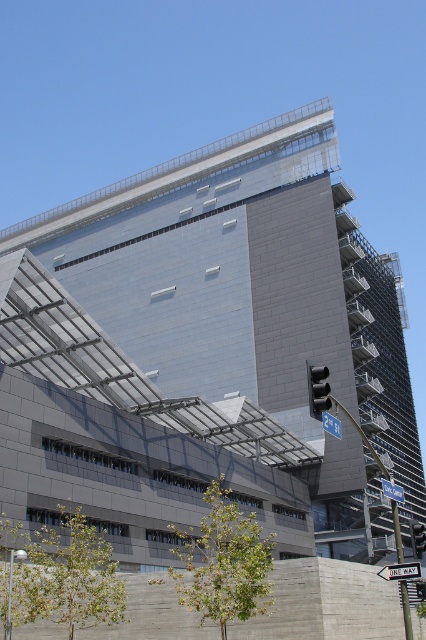
You are a city planner reviewing the architectural design. You need to determine if the white plastic street sign at lower right can be placed in a location where it won not be obscured by the blue metallic street sign at upper center. Based on their sizes, is this possible?

The white plastic street sign at lower right is smaller than the blue metallic street sign at upper center. Since the white plastic street sign is smaller, it can be placed in a position where it won not be obscured by the larger blue metallic street sign at upper center if positioned appropriately.

You are a pedestrian standing in front of the modern building. You want to know which object is taller between the black plastic traffic light at center and the blue metallic street sign at upper center. Can you determine this based on their positions?

The blue metallic street sign at upper center is taller than the black plastic traffic light at center because the traffic light is not as tall as the street sign.